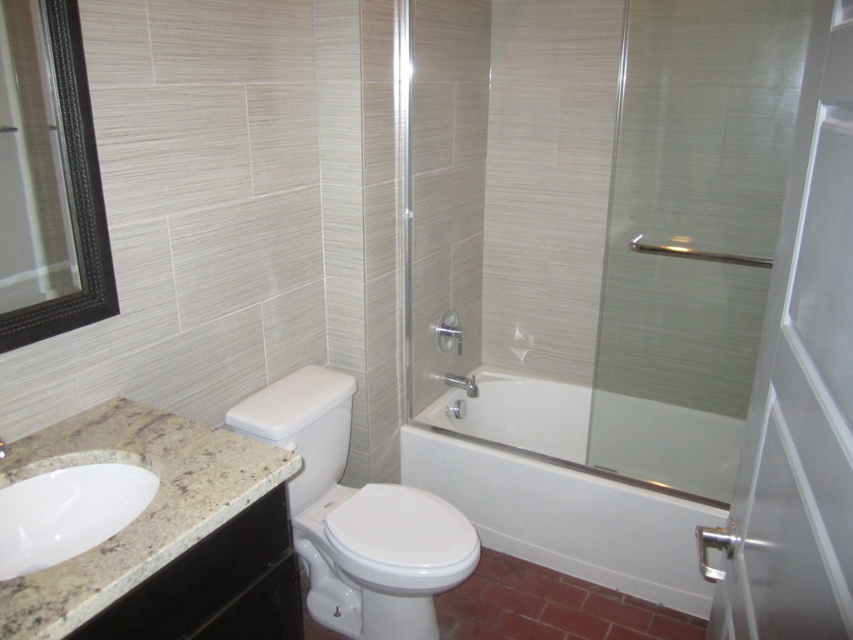
Does white marble sink at lower left have a lesser height compared to matte silver faucet at upper center?

No, white marble sink at lower left is not shorter than matte silver faucet at upper center.

How distant is white marble sink at lower left from matte silver faucet at upper center?

white marble sink at lower left and matte silver faucet at upper center are 4.80 feet apart from each other.

Who is more forward, [41,545] or [457,353]?

Point [41,545] is more forward.

At what (x,y) coordinates should I click in order to perform the action: click on white marble sink at lower left. Please return your answer as a coordinate pair (x, y). This screenshot has width=853, height=640. Looking at the image, I should click on (67, 513).

Does clear glass shower door at right lie behind white glossy bathtub at center?

That is True.

Between clear glass shower door at right and white glossy bathtub at center, which one appears on the left side from the viewer's perspective?

Positioned to the left is white glossy bathtub at center.

Is point (729, 397) farther from camera compared to point (567, 410)?

That is False.

Where is `clear glass shower door at right`? clear glass shower door at right is located at coordinates (692, 234).

Who is positioned more to the right, white glossy bathtub at center or matte silver faucet at upper center?

From the viewer's perspective, white glossy bathtub at center appears more on the right side.

Is point (486, 396) closer to viewer compared to point (434, 333)?

No.

At what (x,y) coordinates should I click in order to perform the action: click on white glossy bathtub at center. Please return your answer as a coordinate pair (x, y). The height and width of the screenshot is (640, 853). Looking at the image, I should click on (555, 490).